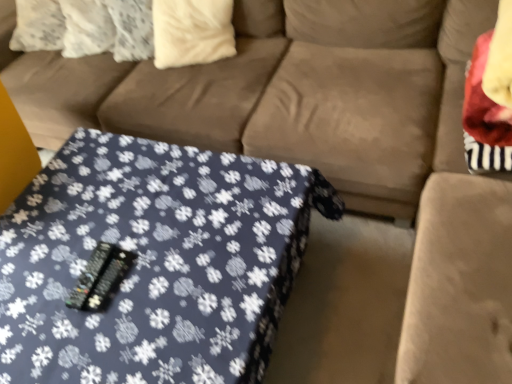
Question: In the image, is blue fabric table at center positioned in front of or behind white soft pillow at upper center?

Choices:
 (A) front
 (B) behind

Answer: (A)

Question: From a real-world perspective, is blue fabric table at center physically located above or below white soft pillow at upper center?

Choices:
 (A) below
 (B) above

Answer: (A)

Question: Is point (223, 297) closer or farther from the camera than point (223, 29)?

Choices:
 (A) closer
 (B) farther

Answer: (A)

Question: Is white soft pillow at upper center bigger or smaller than blue fabric table at center?

Choices:
 (A) big
 (B) small

Answer: (B)

Question: Is white soft pillow at upper center wider or thinner than blue fabric table at center?

Choices:
 (A) wide
 (B) thin

Answer: (B)

Question: Is white soft pillow at upper center spatially inside blue fabric table at center, or outside of it?

Choices:
 (A) outside
 (B) inside

Answer: (A)

Question: From a real-world perspective, is white soft pillow at upper center physically located above or below blue fabric table at center?

Choices:
 (A) below
 (B) above

Answer: (B)